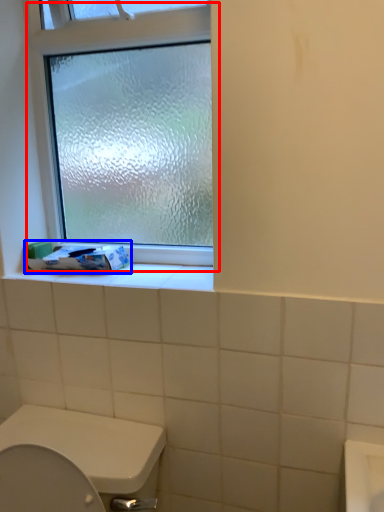
Question: Which object appears closest to the camera in this image, window (highlighted by a red box) or toilet paper (highlighted by a blue box)?

Choices:
 (A) window
 (B) toilet paper

Answer: (A)